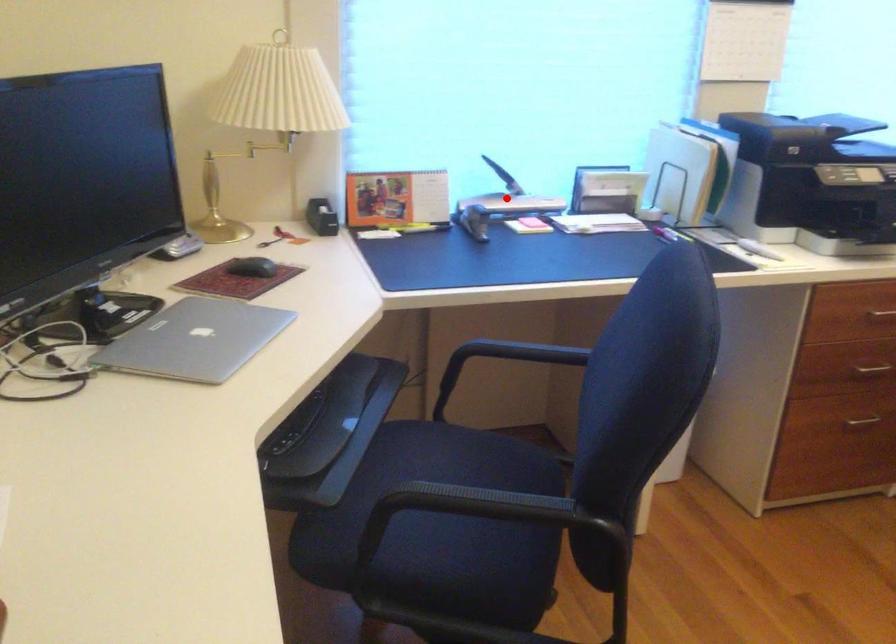
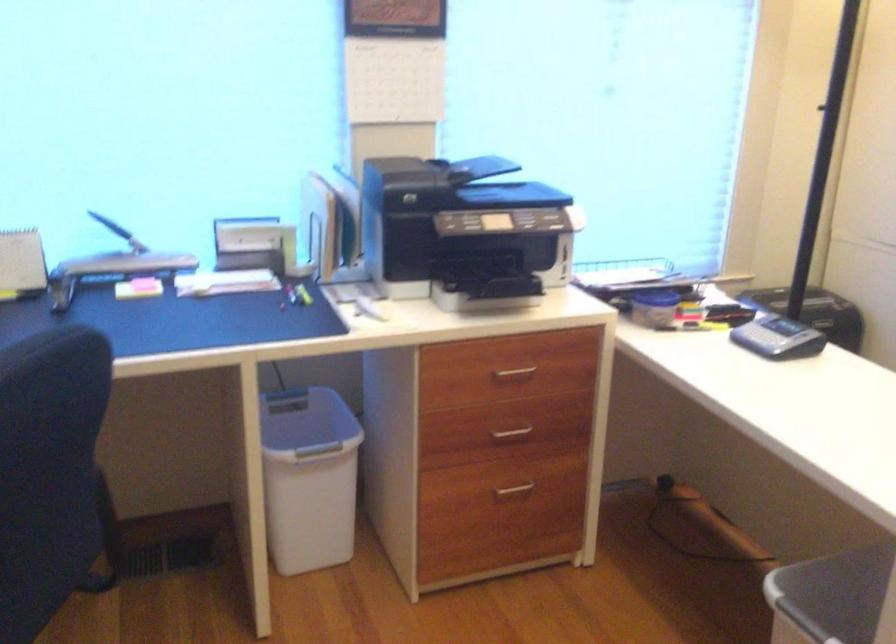
Question: A red point is marked in image1. In image2, is the corresponding 3D point closer to the camera or farther? Reply with the corresponding letter.

Choices:
 (A) The corresponding 3D point is closer.
 (B) The corresponding 3D point is farther.

Answer: (A)